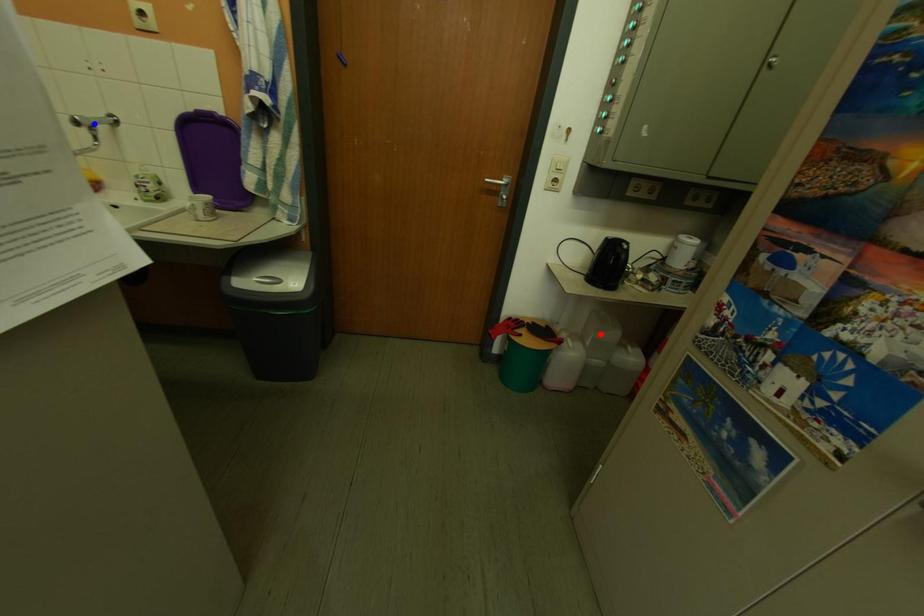
Question: Two points are marked on the image. Which point is closer to the camera?

Choices:
 (A) Blue point is closer.
 (B) Red point is closer.

Answer: (A)